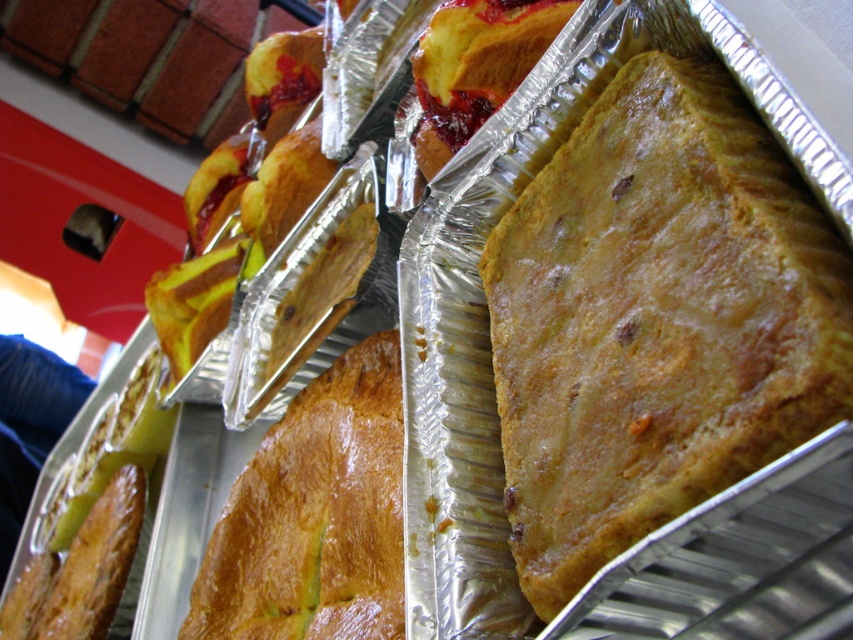
You are a baker who needs to place a 16 inch ruler between the golden brown flaky pastry at center and the golden brown crusty bread at center. Can the ruler fit between them?

The golden brown flaky pastry at center is 15.80 inches from golden brown crusty bread at center, so the 16 inch ruler cannot fit between them because the distance is shorter than the ruler.

Where is the golden brown flaky pastry at center located in the image?

The golden brown flaky pastry at center is located at point (x=656, y=320).

You are a customer at the bakery and want to pick up the pastry closest to you. The pastries are arranged in the trays, and you notice two specific points marked as point (837, 406) and point (325, 552). Which point corresponds to the pastry closer to your current position?

Point (837, 406) is closer to the viewer than point (325, 552), so the pastry at point (837, 406) is closer to your current position.